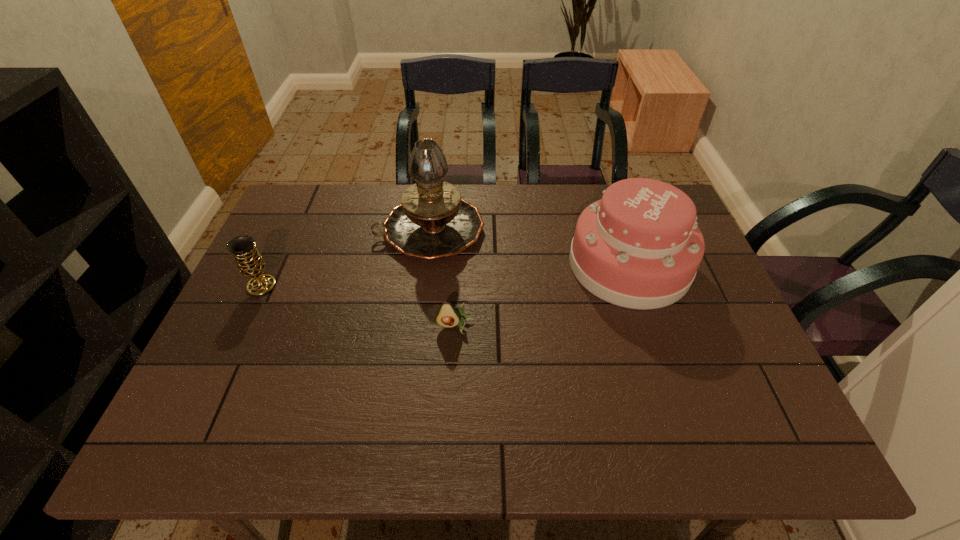
This screenshot has width=960, height=540. Identify the location of vacant area that lies between the avocado and the leftmost object. (359, 306).

Image resolution: width=960 pixels, height=540 pixels. What are the coordinates of `the third closest object to the avocado` in the screenshot? It's located at (243, 248).

The width and height of the screenshot is (960, 540). Identify the location of object that is the second closest one to the tallest object. [243, 248].